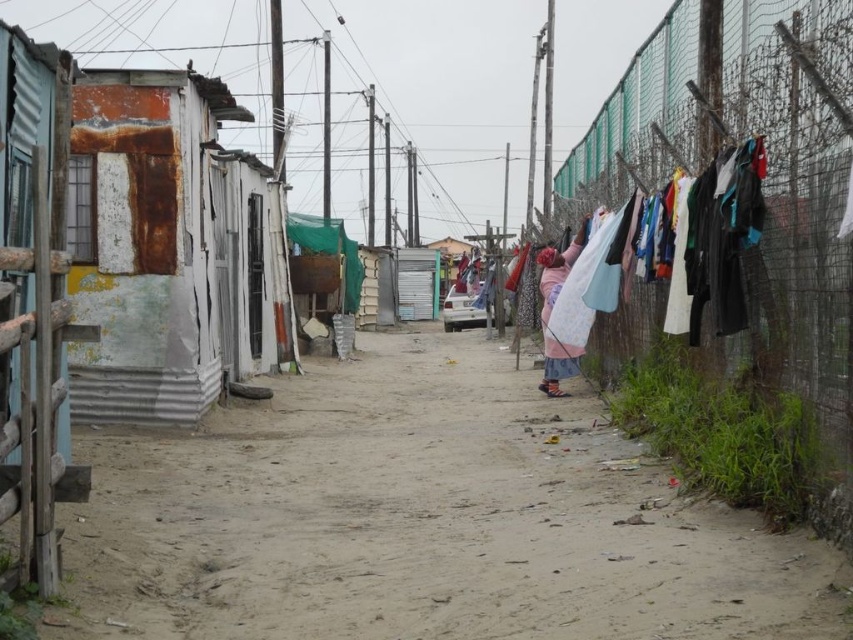
Is dirt ground at center to the right of pink fabric at center from the viewer's perspective?

Incorrect, dirt ground at center is not on the right side of pink fabric at center.

Consider the image. Who is positioned more to the left, dirt ground at center or pink fabric at center?

dirt ground at center is more to the left.

Which is behind, point (250, 509) or point (544, 349)?

The point (544, 349) is behind.

This screenshot has height=640, width=853. Identify the location of dirt ground at center. (421, 520).

Is point (250, 278) closer to camera compared to point (560, 275)?

No, it is not.

Is rusty metal hut at left positioned behind pink fabric at center?

No, rusty metal hut at left is closer to the viewer.

Which is in front, point (207, 237) or point (547, 340)?

Positioned in front is point (207, 237).

In order to click on rusty metal hut at left in this screenshot , I will do `click(167, 248)`.

Between rusty metal fence at right and pink fabric at center, which one appears on the left side from the viewer's perspective?

pink fabric at center

Between rusty metal fence at right and pink fabric at center, which one is positioned lower?

pink fabric at center is lower down.

Identify the location of rusty metal fence at right. (798, 198).

Where is `rusty metal fence at right`? This screenshot has width=853, height=640. rusty metal fence at right is located at coordinates (798, 198).